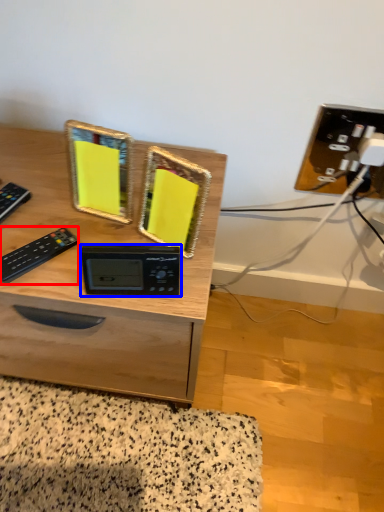
Question: Which of the following is the farthest to the observer, control (highlighted by a red box) or appliance (highlighted by a blue box)?

Choices:
 (A) control
 (B) appliance

Answer: (A)